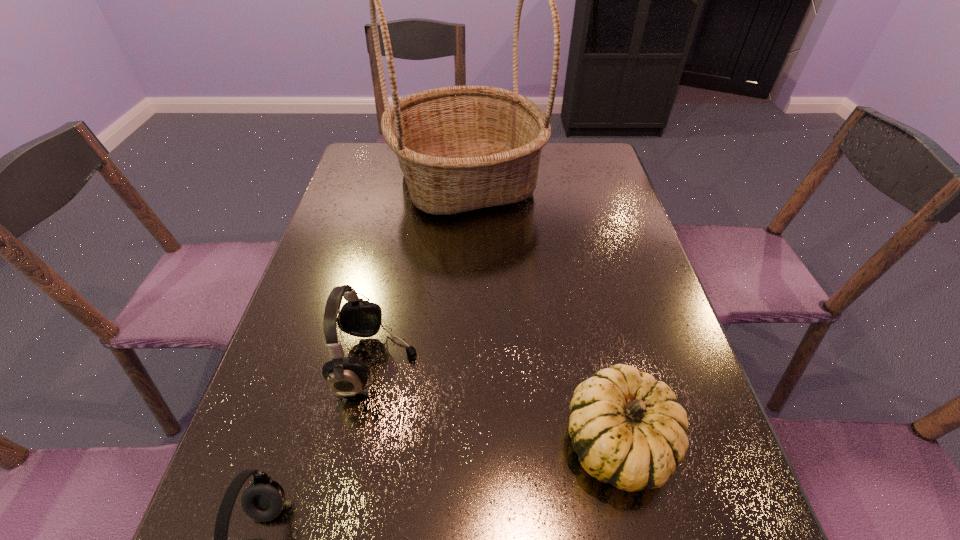
This screenshot has width=960, height=540. I want to click on headset located at the left edge, so click(x=346, y=376).

What are the coordinates of `object located in the right edge section of the desktop` in the screenshot? It's located at (628, 430).

In order to click on object that is at the far left corner in this screenshot , I will do `click(460, 148)`.

In the image, there is a desktop. At what (x,y) coordinates should I click in order to perform the action: click on free space at the left edge. Please return your answer as a coordinate pair (x, y). This screenshot has height=540, width=960. Looking at the image, I should click on (361, 185).

At what (x,y) coordinates should I click in order to perform the action: click on vacant space at the right edge. Please return your answer as a coordinate pair (x, y). This screenshot has height=540, width=960. Looking at the image, I should click on (602, 247).

In the image, there is a desktop. Where is `vacant space at the far left corner`? vacant space at the far left corner is located at coordinates (384, 160).

Image resolution: width=960 pixels, height=540 pixels. What are the coordinates of `free space that is in between the gourd and the basket` in the screenshot? It's located at (542, 312).

Where is `vacant space that is in between the right headset and the gourd`? This screenshot has width=960, height=540. vacant space that is in between the right headset and the gourd is located at coordinates (497, 403).

Where is `vacant space in between the farther headset and the farthest object`? The image size is (960, 540). vacant space in between the farther headset and the farthest object is located at coordinates (421, 272).

This screenshot has width=960, height=540. In order to click on vacant region between the taller headset and the farthest object in this screenshot , I will do `click(421, 272)`.